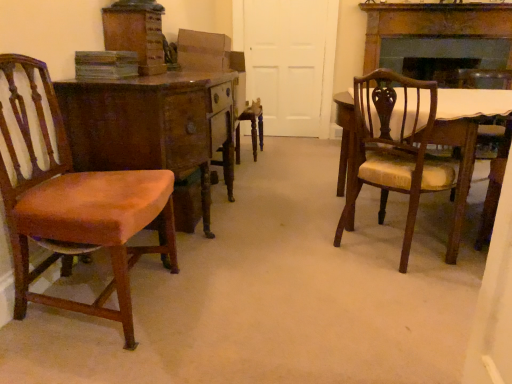
Locate an element on the screen. The height and width of the screenshot is (384, 512). free point to the right of matte brown chair at left, which appears as the 2th chair when viewed from the right is located at coordinates (224, 304).